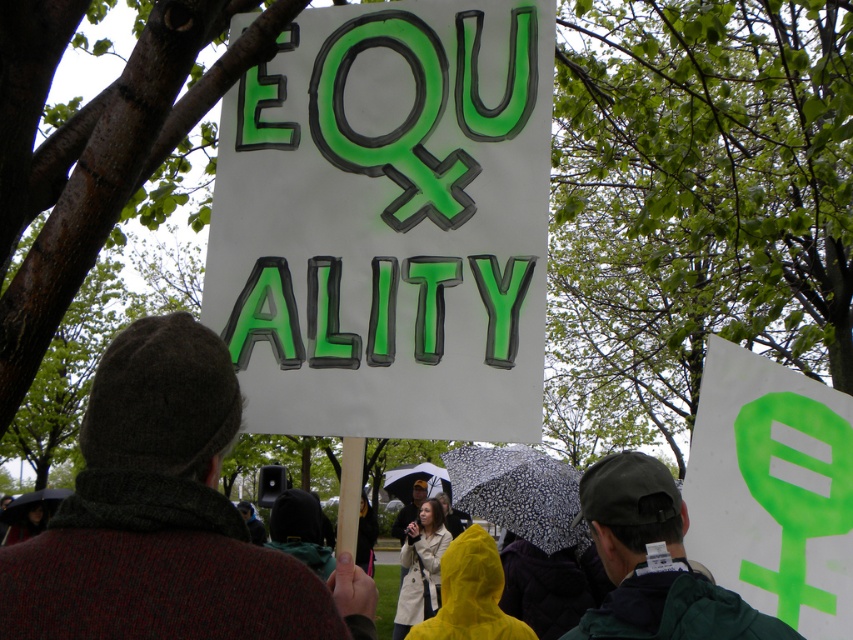
Describe the element at coordinates (518, 493) in the screenshot. I see `black spotted umbrella at center` at that location.

This screenshot has width=853, height=640. Identify the location of black spotted umbrella at center. (518, 493).

Does point (90, 573) come behind point (532, 460)?

That is False.

Who is higher up, knitted wool hat at center or black spotted umbrella at center?

knitted wool hat at center is above.

The width and height of the screenshot is (853, 640). What do you see at coordinates (164, 516) in the screenshot?
I see `knitted wool hat at center` at bounding box center [164, 516].

Locate an element on the screen. The image size is (853, 640). knitted wool hat at center is located at coordinates (164, 516).

Who is more distant from viewer, (383, 378) or (157, 410)?

Point (383, 378)

Can you confirm if green painted cardboard sign at center is shorter than knitted wool hat at center?

No.

Between point (531, 371) and point (117, 582), which one is positioned in front?

Point (117, 582) is more forward.

The width and height of the screenshot is (853, 640). Identify the location of green painted cardboard sign at center. (x=387, y=221).